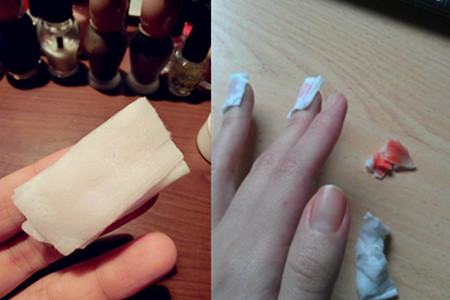
Find the location of a particular element. The width and height of the screenshot is (450, 300). small rectangular sheets of toilet paper is located at coordinates (91, 175).